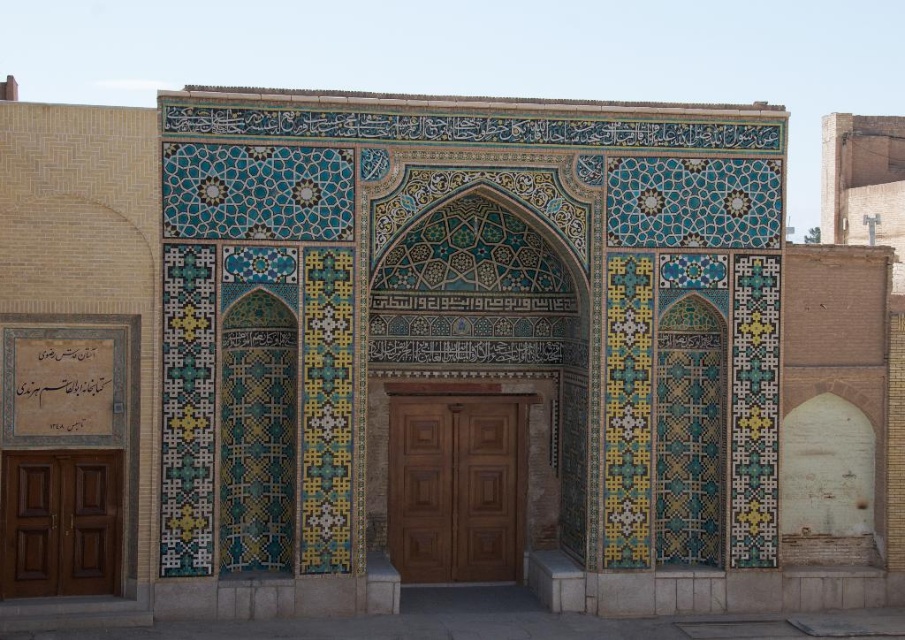
Does brown wooden door at center have a lesser width compared to brown wooden door at left?

Correct, brown wooden door at center's width is less than brown wooden door at left's.

Is brown wooden door at center bigger than brown wooden door at left?

Answer: Actually, brown wooden door at center might be smaller than brown wooden door at left.

Between point (411, 448) and point (118, 538), which one is positioned in front?

Point (118, 538) is in front.

Find the location of a particular element. The height and width of the screenshot is (640, 905). brown wooden door at center is located at coordinates (456, 486).